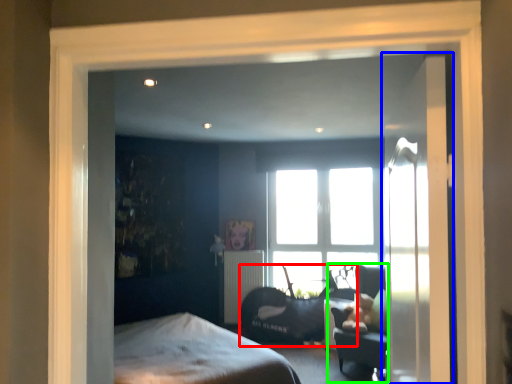
Question: Estimate the real-world distances between objects in this image. Which object is closer to swivel chair (highlighted by a red box), door (highlighted by a blue box) or swivel chair (highlighted by a green box)?

Choices:
 (A) door
 (B) swivel chair

Answer: (B)